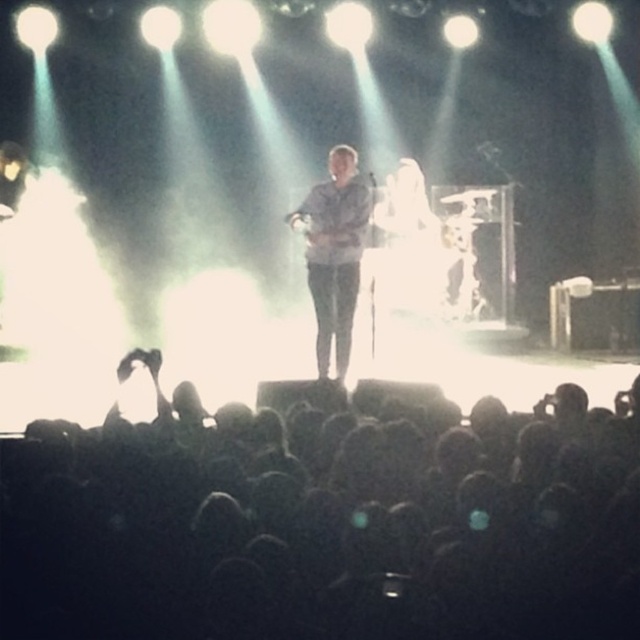
Question: From the image, what is the correct spatial relationship of black matte crowd at lower center in relation to light blue denim shirt at center?

Choices:
 (A) right
 (B) left

Answer: (A)

Question: Which point is farther to the camera?

Choices:
 (A) light blue denim shirt at center
 (B) black matte crowd at lower center

Answer: (A)

Question: Is the position of black matte crowd at lower center less distant than that of light blue denim shirt at center?

Choices:
 (A) yes
 (B) no

Answer: (A)

Question: Does black matte crowd at lower center lie in front of light blue denim shirt at center?

Choices:
 (A) yes
 (B) no

Answer: (A)

Question: Which of the following is the farthest from the observer?

Choices:
 (A) light blue denim shirt at center
 (B) black matte crowd at lower center

Answer: (A)